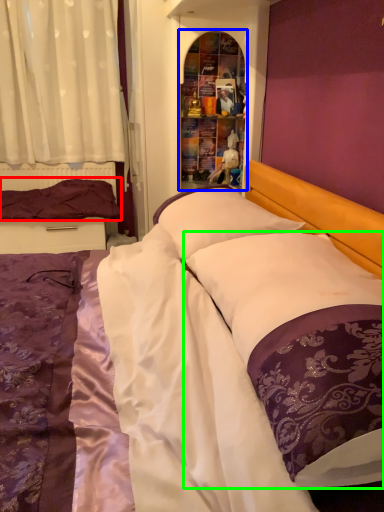
Question: Which is farther away from pillow (highlighted by a red box)? shelf (highlighted by a blue box) or pillow (highlighted by a green box)?

Choices:
 (A) shelf
 (B) pillow

Answer: (B)